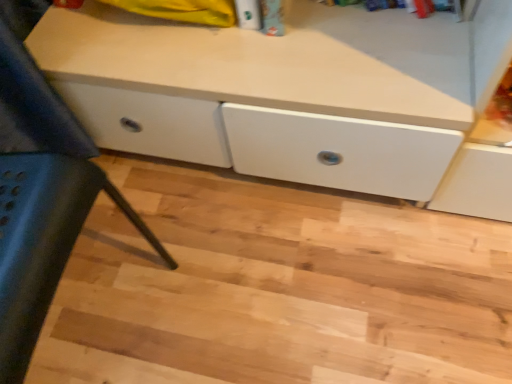
Image resolution: width=512 pixels, height=384 pixels. I want to click on natural wood stair at center, so click(x=276, y=287).

What do you see at coordinates (276, 287) in the screenshot? Image resolution: width=512 pixels, height=384 pixels. I see `natural wood stair at center` at bounding box center [276, 287].

I want to click on matte white cabinet at lower left, so click(42, 242).

The width and height of the screenshot is (512, 384). What do you see at coordinates (42, 242) in the screenshot? I see `matte white cabinet at lower left` at bounding box center [42, 242].

This screenshot has height=384, width=512. In order to click on natural wood stair at center in this screenshot , I will do `click(276, 287)`.

Considering the positions of objects matte white cabinet at lower left and natural wood stair at center in the image provided, who is more to the right, matte white cabinet at lower left or natural wood stair at center?

natural wood stair at center is more to the right.

Is matte white cabinet at lower left in front of or behind natural wood stair at center in the image?

In the image, matte white cabinet at lower left appears in front of natural wood stair at center.

Does point (55, 178) appear closer or farther from the camera than point (438, 319)?

Point (55, 178) appears to be closer to the viewer than point (438, 319).

From the image's perspective, who appears lower, matte white cabinet at lower left or natural wood stair at center?

natural wood stair at center.

From a real-world perspective, is matte white cabinet at lower left above or below natural wood stair at center?

In terms of real-world spatial position, matte white cabinet at lower left is above natural wood stair at center.

Does matte white cabinet at lower left have a lesser width compared to natural wood stair at center?

Yes.

From the picture: Considering the relative sizes of matte white cabinet at lower left and natural wood stair at center in the image provided, is matte white cabinet at lower left taller than natural wood stair at center?

Indeed, matte white cabinet at lower left has a greater height compared to natural wood stair at center.

Is matte white cabinet at lower left bigger than natural wood stair at center?

Indeed, matte white cabinet at lower left has a larger size compared to natural wood stair at center.

Is matte white cabinet at lower left outside of natural wood stair at center?

Yes.

Are matte white cabinet at lower left and natural wood stair at center far apart?

They are positioned close to each other.

Is natural wood stair at center at the back of matte white cabinet at lower left?

matte white cabinet at lower left does not have its back to natural wood stair at center.

Where is `stair behind the matte white cabinet at lower left`? This screenshot has width=512, height=384. stair behind the matte white cabinet at lower left is located at coordinates (276, 287).

Which is more to the right, natural wood stair at center or matte white cabinet at lower left?

From the viewer's perspective, natural wood stair at center appears more on the right side.

Considering the relative positions of natural wood stair at center and matte white cabinet at lower left in the image provided, is natural wood stair at center behind matte white cabinet at lower left?

Yes, it is behind matte white cabinet at lower left.

Which is more distant, (511, 331) or (142, 227)?

Point (142, 227)

From the image's perspective, is natural wood stair at center over matte white cabinet at lower left?

No, from the image's perspective, natural wood stair at center is not over matte white cabinet at lower left.

From a real-world perspective, who is located higher, natural wood stair at center or matte white cabinet at lower left?

matte white cabinet at lower left.

Does natural wood stair at center have a lesser width compared to matte white cabinet at lower left?

Incorrect, the width of natural wood stair at center is not less than that of matte white cabinet at lower left.

Is natural wood stair at center taller than matte white cabinet at lower left?

No, natural wood stair at center is not taller than matte white cabinet at lower left.

Looking at the image, does natural wood stair at center seem bigger or smaller compared to matte white cabinet at lower left?

Considering their sizes, natural wood stair at center takes up less space than matte white cabinet at lower left.

Is matte white cabinet at lower left inside natural wood stair at center?

Definitely not — matte white cabinet at lower left is not inside natural wood stair at center.

Is natural wood stair at center far from matte white cabinet at lower left?

No, natural wood stair at center is in close proximity to matte white cabinet at lower left.

Does natural wood stair at center turn towards matte white cabinet at lower left?

No, natural wood stair at center does not turn towards matte white cabinet at lower left.

Can you tell me how much natural wood stair at center and matte white cabinet at lower left differ in facing direction?

The angular difference between natural wood stair at center and matte white cabinet at lower left is 4.61 degrees.

This screenshot has height=384, width=512. I want to click on furniture lying in front of the natural wood stair at center, so click(42, 242).

Find the location of a particular element. This screenshot has height=384, width=512. furniture that appears on the left of natural wood stair at center is located at coordinates (42, 242).

Locate an element on the screen. stair directly beneath the matte white cabinet at lower left (from a real-world perspective) is located at coordinates (276, 287).